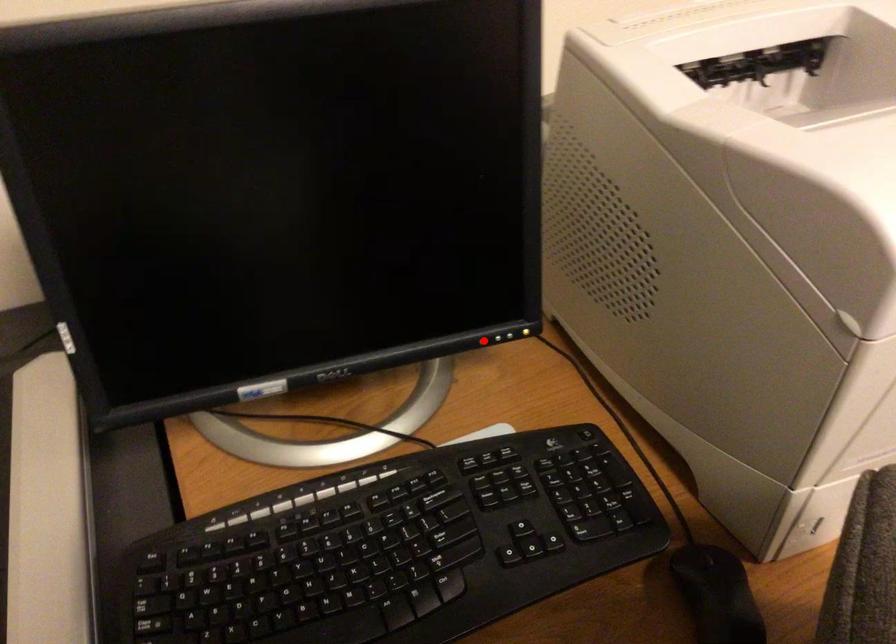
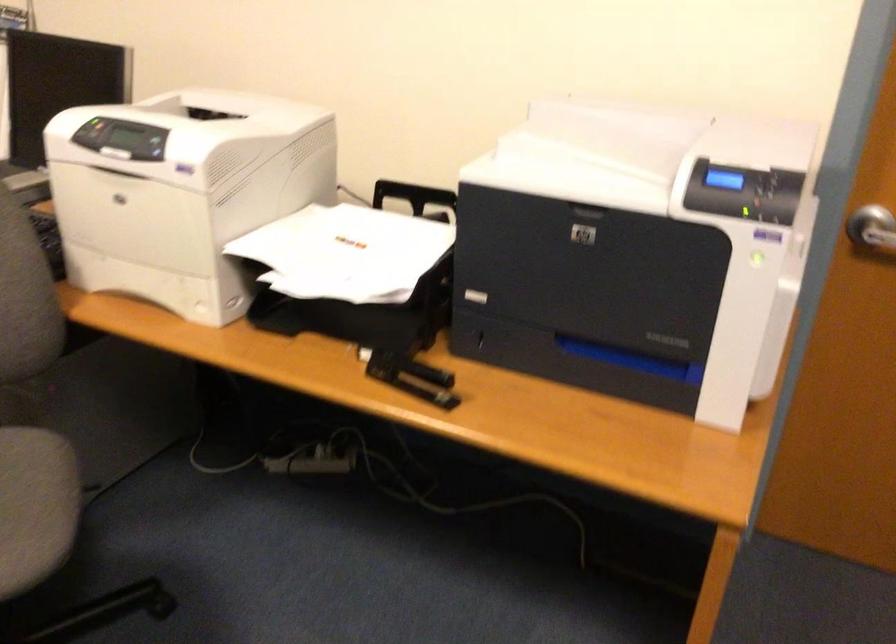
Question: I am providing you with two images of the same scene from different viewpoints. A red point is marked on the first image. Is the red point's position out of view in image 2?

Choices:
 (A) Yes
 (B) No

Answer: (A)